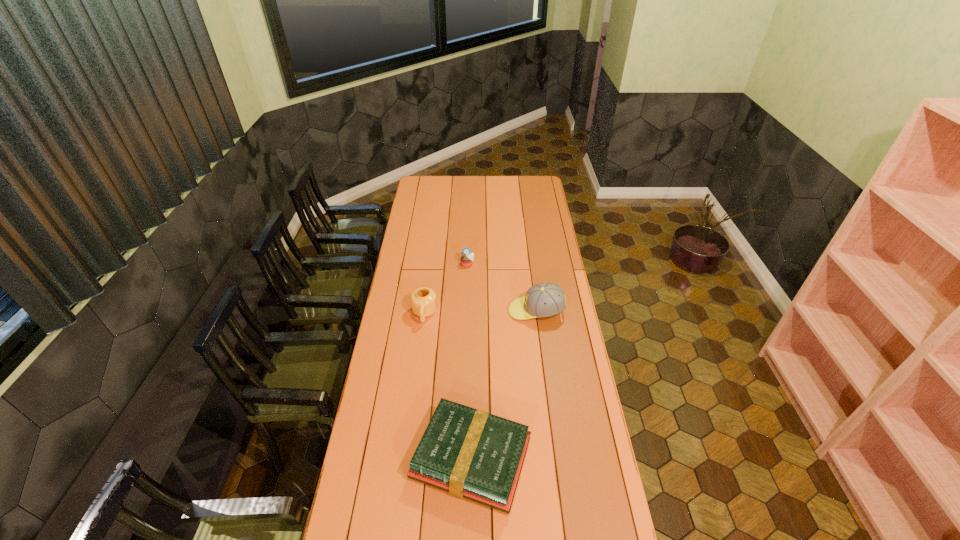
Where is `free area in between the mug and the muffin`? free area in between the mug and the muffin is located at coordinates (446, 289).

Locate an element on the screen. The width and height of the screenshot is (960, 540). unoccupied position between the nearest object and the mug is located at coordinates (447, 386).

At what (x,y) coordinates should I click in order to perform the action: click on free area in between the baseball cap and the nearest object. Please return your answer as a coordinate pair (x, y). Looking at the image, I should click on (504, 384).

Locate an element on the screen. The image size is (960, 540). unoccupied position between the tallest object and the hardback book is located at coordinates (504, 384).

Where is `free area in between the muffin and the mug`? The width and height of the screenshot is (960, 540). free area in between the muffin and the mug is located at coordinates (446, 289).

You are a GUI agent. You are given a task and a screenshot of the screen. Output one action in this format:
    pyautogui.click(x=<x>, y=<y>)
    Task: Click on the free space between the nearest object and the muffin
    This screenshot has height=540, width=960.
    Given the screenshot: What is the action you would take?
    pyautogui.click(x=469, y=361)

Find the location of `object that stands as the closest to the mug`. object that stands as the closest to the mug is located at coordinates (467, 258).

Locate which object ranks third in proximity to the nearest object. Please provide its 2D coordinates. Your answer should be formatted as a tuple, i.e. [(x, y)], where the tuple contains the x and y coordinates of a point satisfying the conditions above.

[(467, 258)]

Locate an element on the screen. free region that satisfies the following two spatial constraints: 1. on the front-facing side of the nearest object; 2. on the left side of the farthest object is located at coordinates (462, 458).

Locate an element on the screen. The width and height of the screenshot is (960, 540). free spot that satisfies the following two spatial constraints: 1. on the handle side of the mug; 2. on the right side of the hardback book is located at coordinates (406, 458).